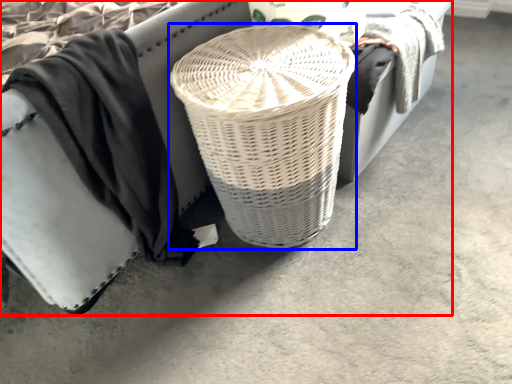
Question: Among these objects, which one is nearest to the camera, furniture (highlighted by a red box) or basket (highlighted by a blue box)?

Choices:
 (A) furniture
 (B) basket

Answer: (A)